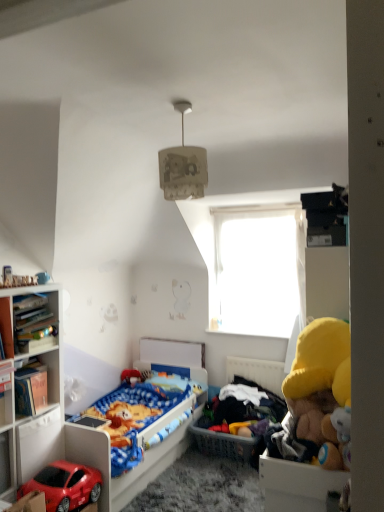
You are a GUI agent. You are given a task and a screenshot of the screen. Output one action in this format:
    pyautogui.click(x=<x>, y=<y>)
    Task: Click on the vacant point above white paper lampshade at upper center (from a real-world perspective)
    The image size is (384, 512).
    Given the screenshot: What is the action you would take?
    pyautogui.click(x=172, y=103)